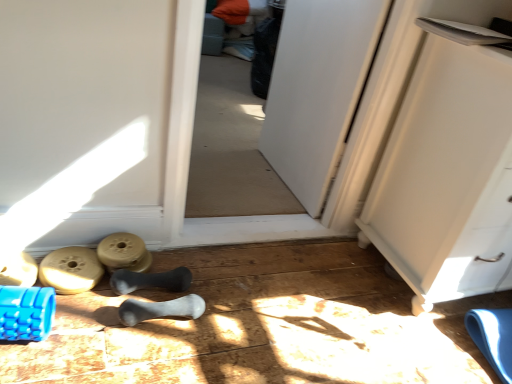
Where is `vacant area that is in front of gray rubber bone at center, arranged as the first footwear when viewed from the right`? vacant area that is in front of gray rubber bone at center, arranged as the first footwear when viewed from the right is located at coordinates (x=139, y=355).